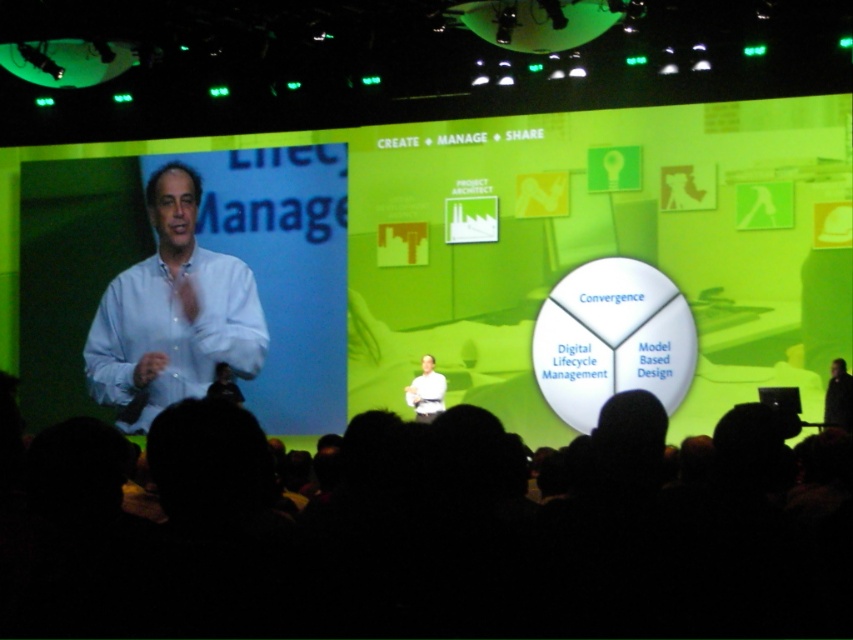
Question: Which point is farther from the camera taking this photo?

Choices:
 (A) (120, 292)
 (B) (413, 387)
 (C) (479, 492)

Answer: (A)

Question: Among these objects, which one is nearest to the camera?

Choices:
 (A) white matte shirt at center
 (B) black fabric at lower center
 (C) light blue shirt at left

Answer: (B)

Question: Does black fabric at lower center lie in front of white matte shirt at center?

Choices:
 (A) yes
 (B) no

Answer: (A)

Question: Which point is farther to the camera?

Choices:
 (A) (25, 486)
 (B) (234, 284)
 (C) (427, 406)

Answer: (B)

Question: Can you confirm if black fabric at lower center is positioned above light blue shirt at left?

Choices:
 (A) yes
 (B) no

Answer: (B)

Question: Is light blue shirt at left below white matte shirt at center?

Choices:
 (A) yes
 (B) no

Answer: (B)